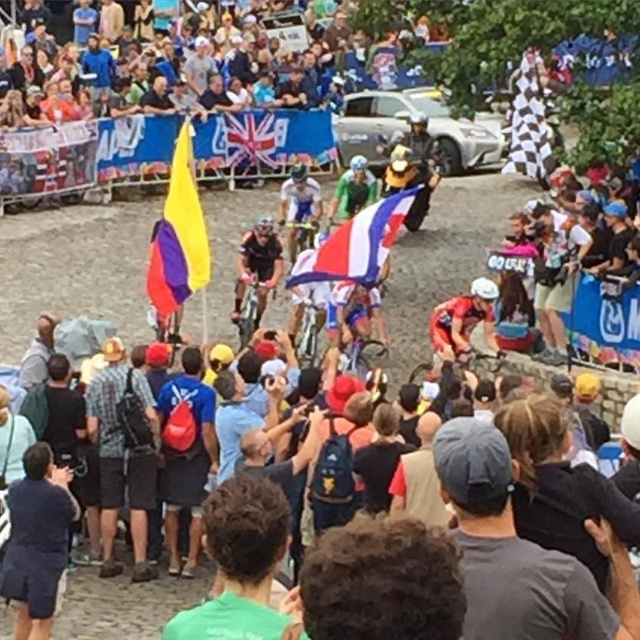
Question: Based on their relative distances, which object is farther from the blue and white striped flag at center?

Choices:
 (A) yellowmaterial/textureflag at upper left
 (B) dark brown leather jacket at lower right
 (C) shiny black helmet at center

Answer: (B)

Question: Does dark curly hair at center have a greater width compared to green fabric shirt at center?

Choices:
 (A) no
 (B) yes

Answer: (B)

Question: Which object is the closest to the black fabric at center?

Choices:
 (A) dark blue shorts at lower left
 (B) blue fabric backpack at center

Answer: (B)

Question: Can you confirm if green fabric shirt at center is positioned to the left of blue and white striped flag at center?

Choices:
 (A) no
 (B) yes

Answer: (B)

Question: Which point is closer to the camera taking this photo?

Choices:
 (A) (330, 250)
 (B) (179, 522)
 (C) (234, 545)
 (D) (385, 454)

Answer: (C)

Question: Can you confirm if checkered fabric flag at upper right is thinner than shiny black helmet at center?

Choices:
 (A) no
 (B) yes

Answer: (A)